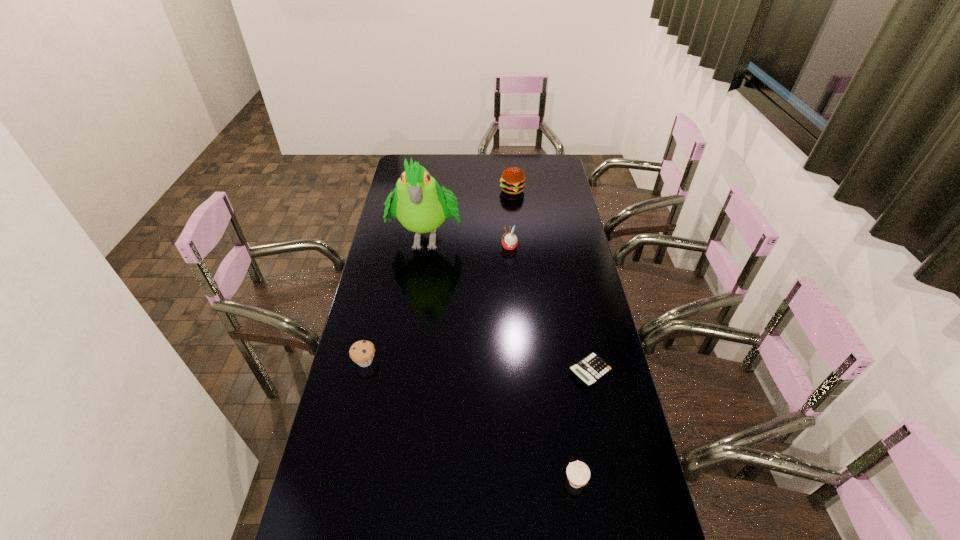
The width and height of the screenshot is (960, 540). I want to click on unoccupied position between the farthest muffin and the second farthest muffin, so click(437, 304).

Locate an element on the screen. Image resolution: width=960 pixels, height=540 pixels. empty space between the calculator and the farthest object is located at coordinates (551, 281).

You are a GUI agent. You are given a task and a screenshot of the screen. Output one action in this format:
    pyautogui.click(x=<x>, y=<y>)
    Task: Click on the free space between the tallest object and the rightmost muffin
    The width and height of the screenshot is (960, 540).
    Given the screenshot: What is the action you would take?
    pyautogui.click(x=501, y=359)

This screenshot has height=540, width=960. In order to click on unoccupied area between the hamburger and the tallest object in this screenshot , I will do point(469,213).

Find the location of `free space between the farthest muffin and the nearest object`. free space between the farthest muffin and the nearest object is located at coordinates (542, 364).

Find the location of a particular element. The image size is (960, 540). the second closest object to the calculator is located at coordinates click(509, 240).

Locate an element on the screen. The height and width of the screenshot is (540, 960). object that is the nearest to the farthest object is located at coordinates (419, 204).

You are a GUI agent. You are given a task and a screenshot of the screen. Output one action in this format:
    pyautogui.click(x=<x>, y=<y>)
    Task: Click on the muffin that stands as the second closest to the nearest object
    The height and width of the screenshot is (540, 960).
    Given the screenshot: What is the action you would take?
    pyautogui.click(x=509, y=240)

Choose which muffin is the third nearest neighbor to the tallest object. Please provide its 2D coordinates. Your answer should be formatted as a tuple, i.e. [(x, y)], where the tuple contains the x and y coordinates of a point satisfying the conditions above.

[(578, 473)]

Locate an element on the screen. Image resolution: width=960 pixels, height=540 pixels. free spot that satisfies the following two spatial constraints: 1. on the beak of the calculator; 2. on the right side of the tallest object is located at coordinates (407, 372).